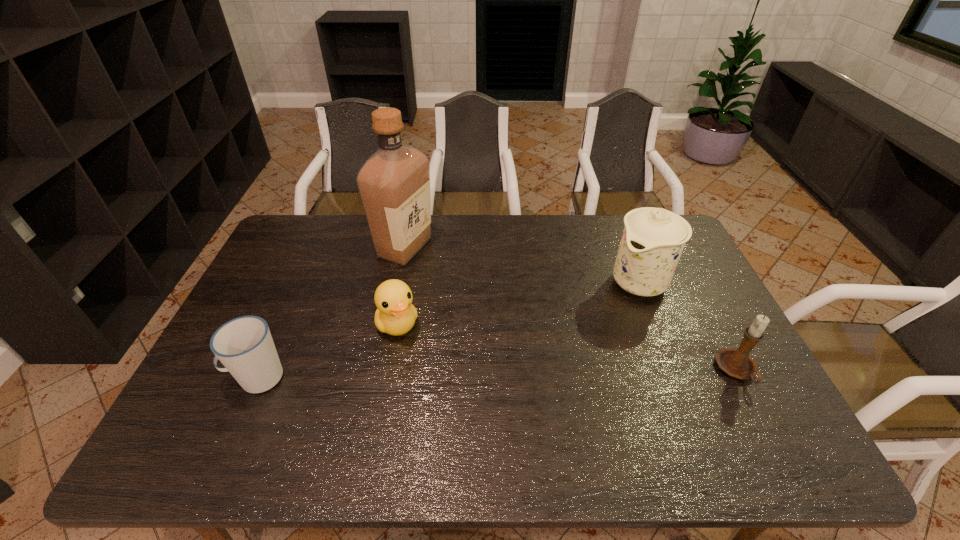
At what (x,y) coordinates should I click in order to perform the action: click on candle holder situated at the right edge. Please return your answer as a coordinate pair (x, y). Looking at the image, I should click on (737, 363).

Identify the location of chinaware located at the right edge. (653, 239).

Locate an element on the screen. The height and width of the screenshot is (540, 960). object situated at the near left corner is located at coordinates (244, 345).

Find the location of `object situated at the near right corner`. object situated at the near right corner is located at coordinates (737, 363).

In order to click on vacant point at the far edge in this screenshot , I will do `click(503, 239)`.

Image resolution: width=960 pixels, height=540 pixels. I want to click on vacant space at the near edge, so click(x=430, y=409).

The image size is (960, 540). What are the coordinates of `free space at the left edge of the desktop` in the screenshot? It's located at (260, 276).

The width and height of the screenshot is (960, 540). In order to click on vacant space at the right edge of the desktop in this screenshot , I will do `click(727, 326)`.

You are a GUI agent. You are given a task and a screenshot of the screen. Output one action in this format:
    pyautogui.click(x=<x>, y=<y>)
    Task: Click on the vacant space at the near right corner of the desktop
    
    Given the screenshot: What is the action you would take?
    pyautogui.click(x=741, y=399)

Locate an element on the screen. free space between the candle holder and the cup is located at coordinates (497, 374).